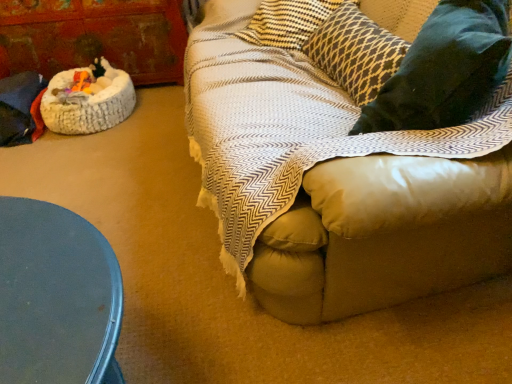
Where is `vacant area that is situated to the right of white fluffy cat bed at left`? vacant area that is situated to the right of white fluffy cat bed at left is located at coordinates (161, 112).